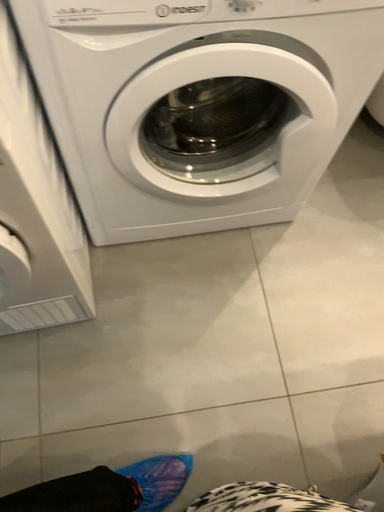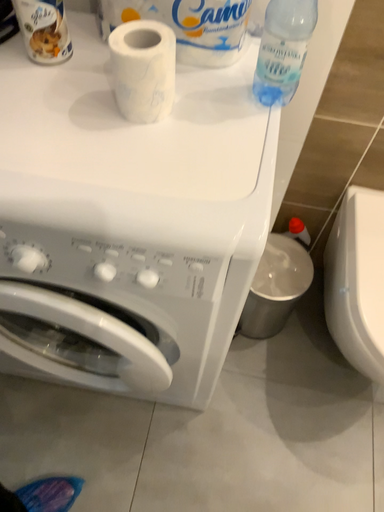
Question: How did the camera likely rotate when shooting the video?

Choices:
 (A) rotated upward
 (B) rotated downward

Answer: (A)